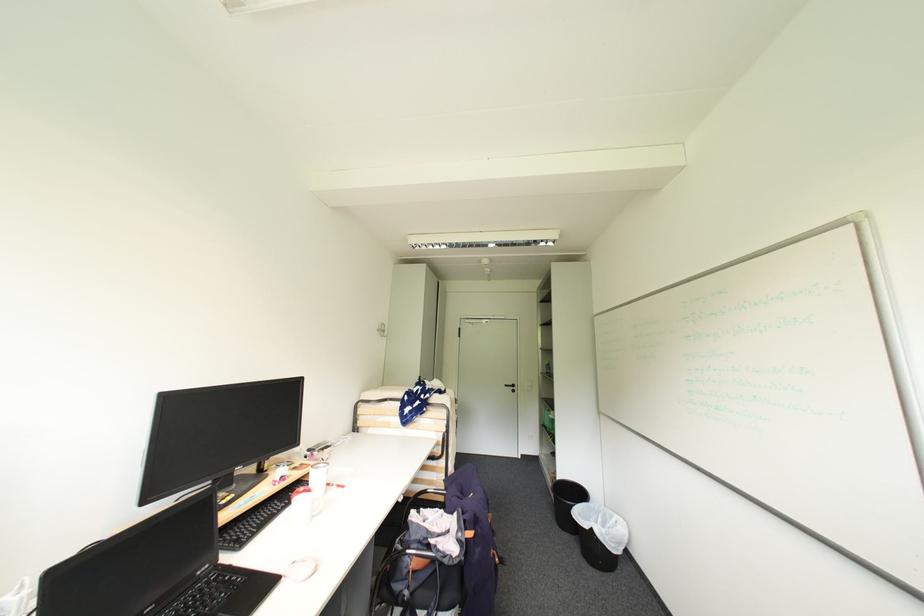
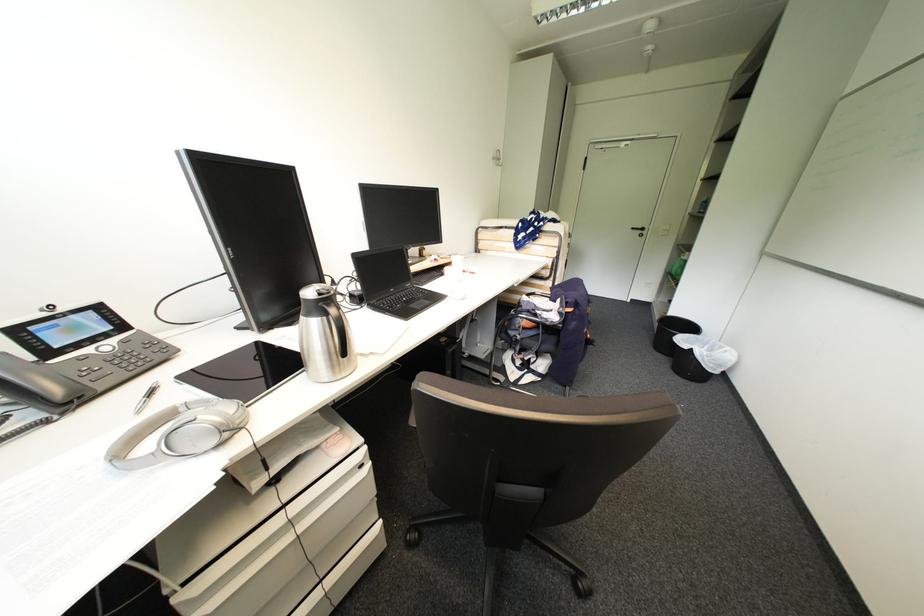
Locate, in the second image, the point that corresponds to pixel 565 528 in the first image.

(660, 351)